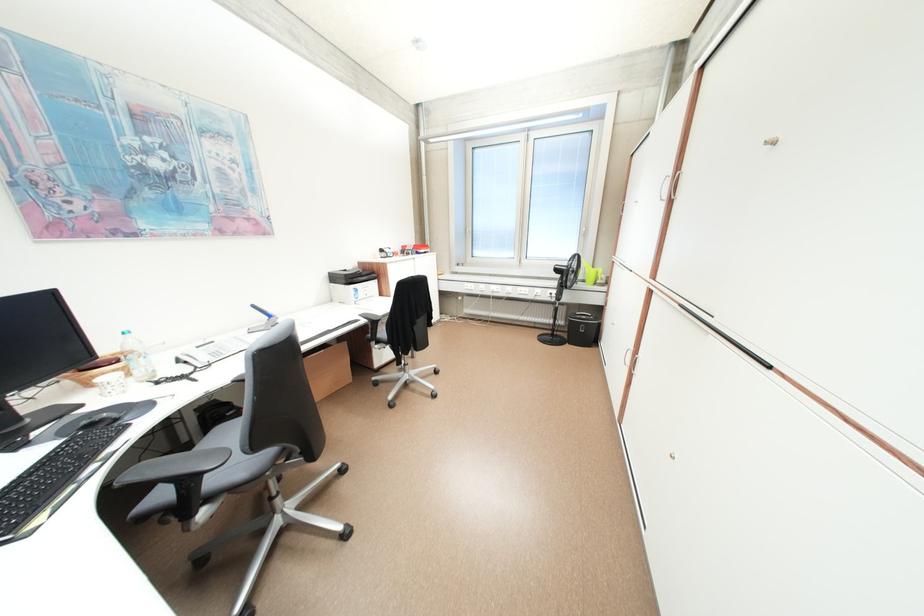
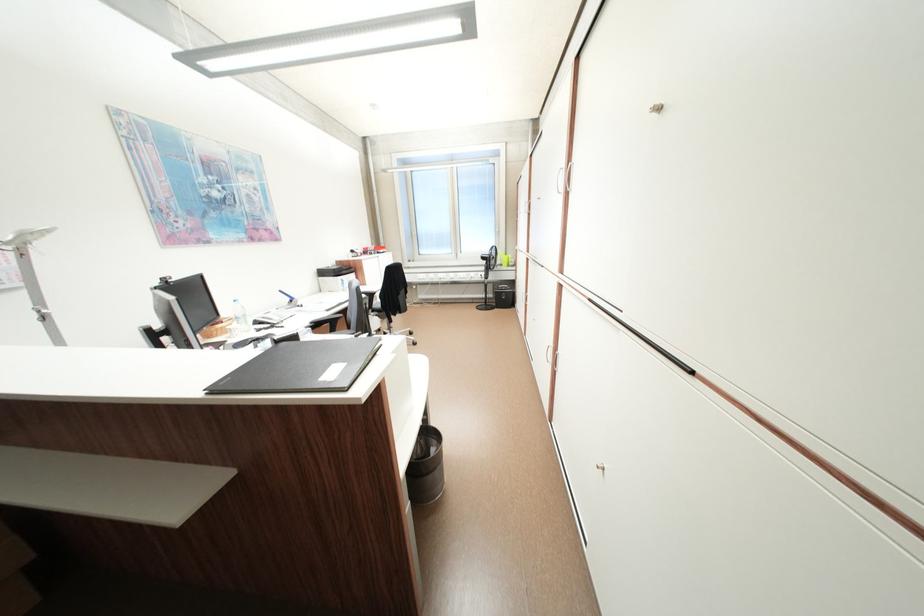
Question: I am providing you with two images of the same scene from different viewpoints. Please identify which objects are invisible in image2.

Choices:
 (A) computer mouse
 (B) paper with clip
 (C) telephone handset
 (D) chair armrest

Answer: (A)